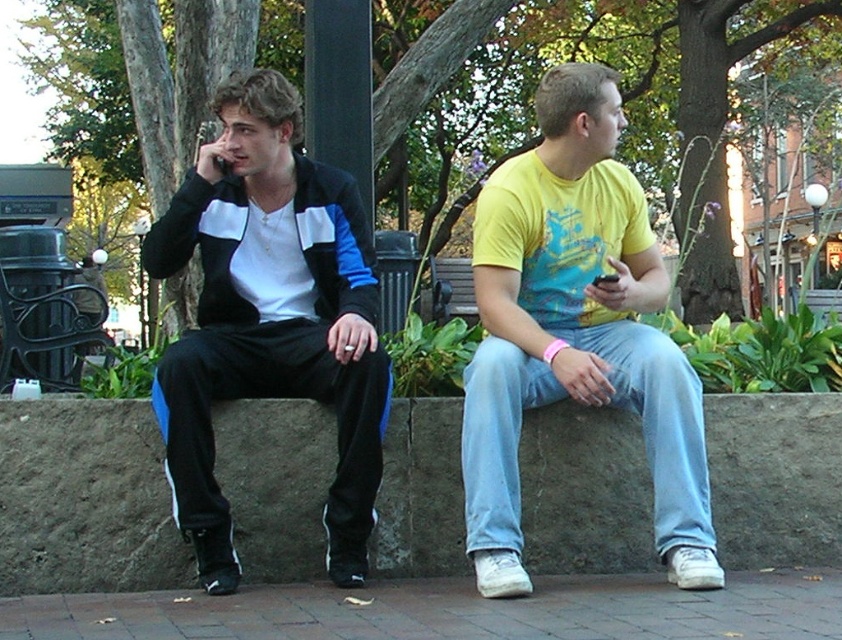
Does concrete curb at lower center appear over matte black tracksuit at left?

Actually, concrete curb at lower center is below matte black tracksuit at left.

Is point (643, 529) positioned in front of point (296, 109)?

No.

Which is in front, point (78, 481) or point (352, 444)?

Point (352, 444)

Where is `concrete curb at lower center`? This screenshot has width=842, height=640. concrete curb at lower center is located at coordinates (84, 499).

Is point (526, 168) positioned in front of point (217, 355)?

No, (526, 168) is behind (217, 355).

Is yellow matte t-shirt at center bigger than matte black tracksuit at left?

No.

Is point (571, 131) farther from viewer compared to point (258, 376)?

No, (571, 131) is in front of (258, 376).

You are a GUI agent. You are given a task and a screenshot of the screen. Output one action in this format:
    pyautogui.click(x=<x>, y=<y>)
    Task: Click on the yellow matte t-shirt at center
    The image size is (842, 640).
    Given the screenshot: What is the action you would take?
    pyautogui.click(x=574, y=332)

From the picture: Can you confirm if concrete curb at lower center is smaller than yellow matte t-shirt at center?

Indeed, concrete curb at lower center has a smaller size compared to yellow matte t-shirt at center.

Who is lower down, concrete curb at lower center or yellow matte t-shirt at center?

concrete curb at lower center

Between point (432, 493) and point (562, 97), which one is positioned behind?

Positioned behind is point (432, 493).

The height and width of the screenshot is (640, 842). Identify the location of concrete curb at lower center. (84, 499).